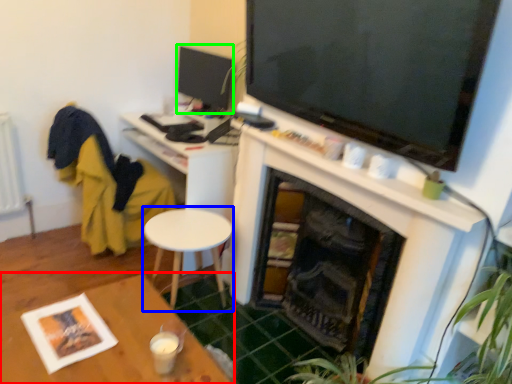
Question: Which object is the farthest from table (highlighted by a red box)? Choose among these: round table (highlighted by a blue box) or tv show (highlighted by a green box).

Choices:
 (A) round table
 (B) tv show

Answer: (B)